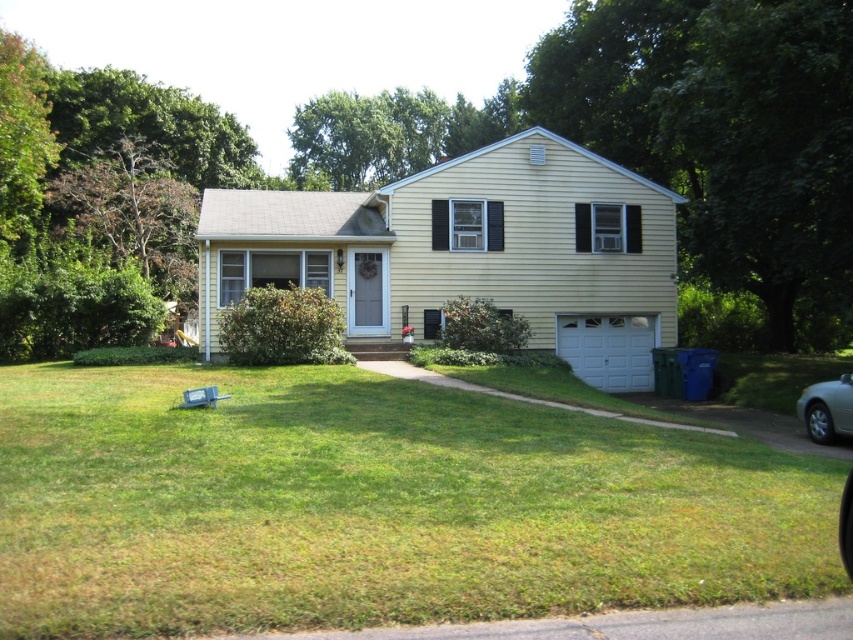
Question: Which point appears farthest from the camera in this image?

Choices:
 (A) (848, 384)
 (B) (445, 449)

Answer: (A)

Question: Which of the following is the closest to the observer?

Choices:
 (A) tap(634, 483)
 (B) tap(816, 385)

Answer: (A)

Question: Does green grass at lower center appear over silver metallic car at lower right?

Choices:
 (A) no
 (B) yes

Answer: (B)

Question: Is green grass at lower center below silver metallic car at lower right?

Choices:
 (A) no
 (B) yes

Answer: (A)

Question: Can you confirm if green grass at lower center is positioned above silver metallic car at lower right?

Choices:
 (A) yes
 (B) no

Answer: (A)